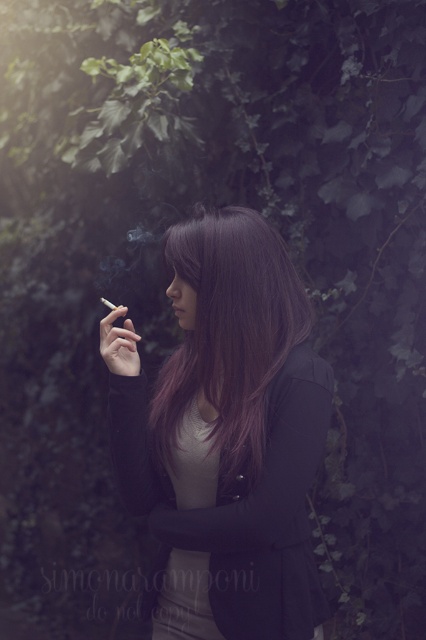
Question: Considering the relative positions of smooth black hair at center and purple shiny hair at center in the image provided, where is smooth black hair at center located with respect to purple shiny hair at center?

Choices:
 (A) left
 (B) right

Answer: (A)

Question: Does smooth black hair at center appear over purple shiny hair at center?

Choices:
 (A) yes
 (B) no

Answer: (B)

Question: Is smooth black hair at center above purple shiny hair at center?

Choices:
 (A) no
 (B) yes

Answer: (A)

Question: Which of the following is the farthest from the observer?

Choices:
 (A) purple shiny hair at center
 (B) smooth black hair at center

Answer: (A)